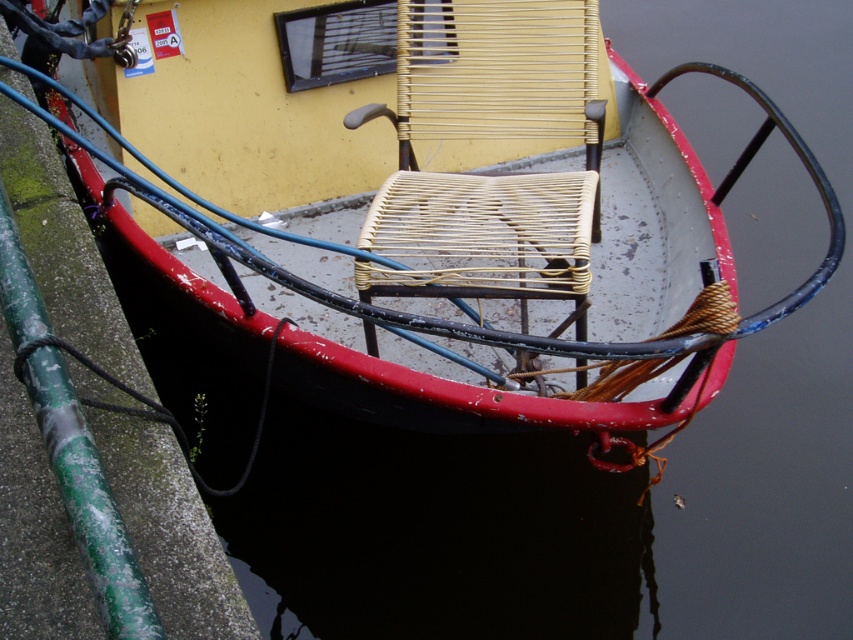
Is point (598, 163) positioned in front of point (456, 195)?

No.

Image resolution: width=853 pixels, height=640 pixels. In order to click on rusty metal boat at center in this screenshot , I will do `click(450, 216)`.

Who is more forward, (410, 26) or (543, 284)?

Point (543, 284)

Identify the location of rusty metal boat at center. (450, 216).